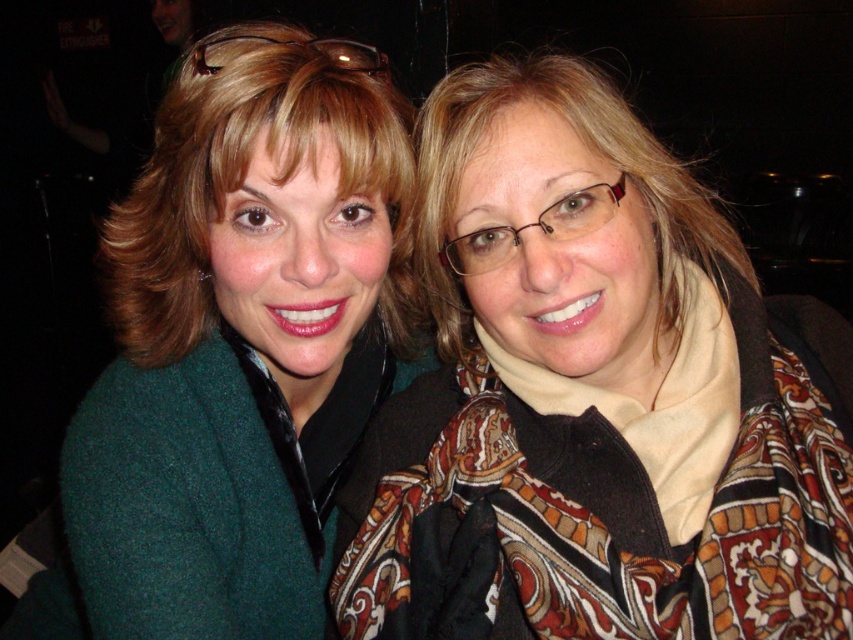
Who is more distant from viewer, (405, 342) or (285, 173)?

Positioned behind is point (405, 342).

Measure the distance between green woolen sweater at upper left and matte green sweater at upper left.

2.73 inches

Between point (109, 433) and point (397, 221), which one is positioned behind?

Positioned behind is point (397, 221).

The height and width of the screenshot is (640, 853). What are the coordinates of `green woolen sweater at upper left` in the screenshot? It's located at (241, 339).

Does green woolen sweater at upper left have a greater height compared to matte brown scarf at right?

Correct, green woolen sweater at upper left is much taller as matte brown scarf at right.

Is green woolen sweater at upper left positioned behind matte brown scarf at right?

That is True.

Image resolution: width=853 pixels, height=640 pixels. Find the location of `green woolen sweater at upper left`. green woolen sweater at upper left is located at coordinates (241, 339).

Is the position of paisley-patterned scarf at center more distant than that of matte brown scarf at right?

No, paisley-patterned scarf at center is in front of matte brown scarf at right.

Does paisley-patterned scarf at center have a lesser width compared to matte brown scarf at right?

In fact, paisley-patterned scarf at center might be wider than matte brown scarf at right.

The image size is (853, 640). Describe the element at coordinates (590, 397) in the screenshot. I see `paisley-patterned scarf at center` at that location.

I want to click on paisley-patterned scarf at center, so click(x=590, y=397).